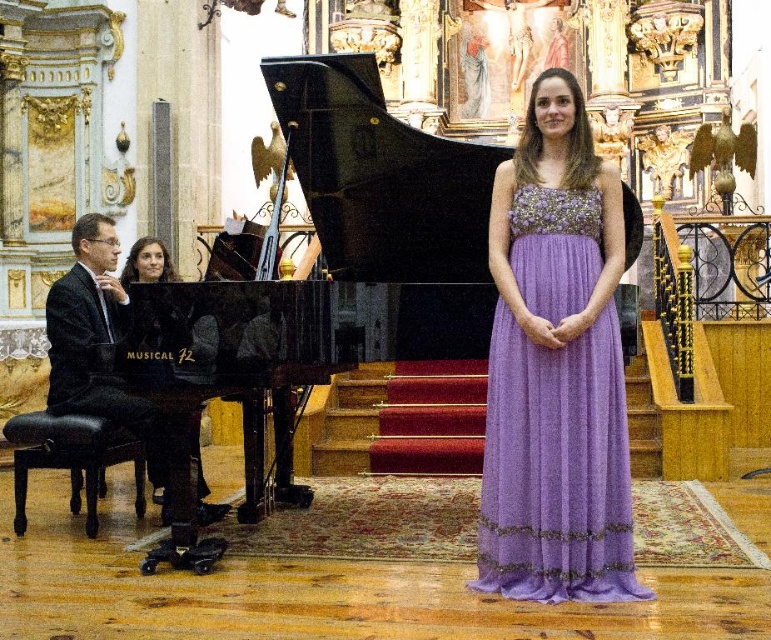
Question: Estimate the real-world distances between objects in this image. Which object is farther from the matte black piano at left?

Choices:
 (A) black glossy suit at left
 (B) black glossy harpsichord at center

Answer: (B)

Question: Which of the following is the farthest from the observer?

Choices:
 (A) black glossy harpsichord at center
 (B) black glossy suit at left

Answer: (B)

Question: Is black leather stool at lower left closer to the viewer compared to matte black piano at left?

Choices:
 (A) yes
 (B) no

Answer: (A)

Question: Considering the real-world distances, which object is farthest from the black glossy harpsichord at center?

Choices:
 (A) black leather stool at lower left
 (B) matte black piano at left
 (C) lavender chiffon dress at center

Answer: (B)

Question: Can you confirm if lavender chiffon dress at center is wider than matte black piano at left?

Choices:
 (A) no
 (B) yes

Answer: (A)

Question: Does black glossy harpsichord at center appear over black leather stool at lower left?

Choices:
 (A) no
 (B) yes

Answer: (B)